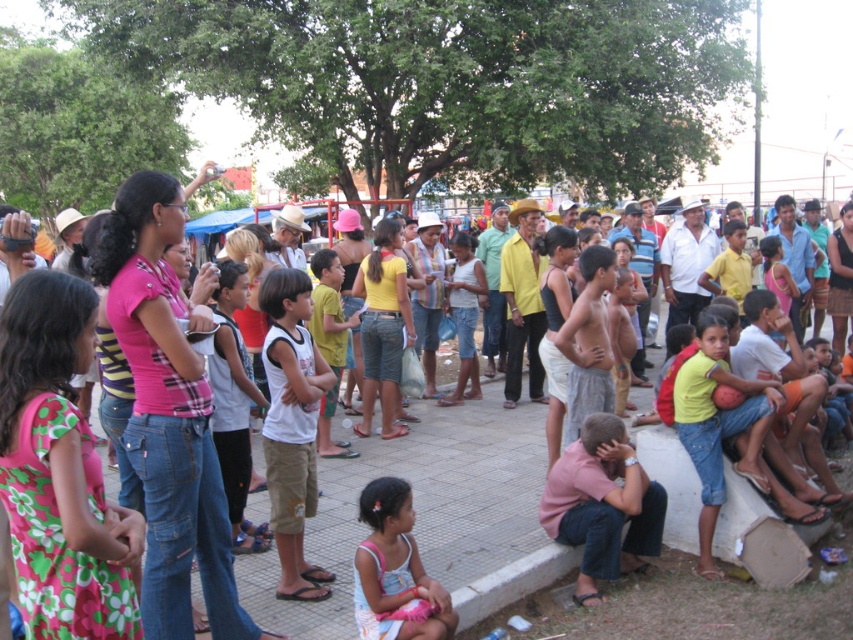
Question: Can you confirm if white cotton tank top at center is positioned below yellow matte shirt at lower right?

Choices:
 (A) yes
 (B) no

Answer: (B)

Question: Which point is farther to the camera?

Choices:
 (A) yellow matte shirt at lower right
 (B) jeans at center
 (C) white cotton dress at center

Answer: (A)

Question: Which is nearer to the white cotton dress at center?

Choices:
 (A) yellow matte shirt at lower right
 (B) jeans at center
 (C) white cotton tank top at center

Answer: (B)

Question: Can you confirm if jeans at center is bigger than yellow matte shirt at lower right?

Choices:
 (A) yes
 (B) no

Answer: (A)

Question: Does jeans at center have a smaller size compared to white cotton dress at center?

Choices:
 (A) no
 (B) yes

Answer: (A)

Question: Which of the following is the closest to the observer?

Choices:
 (A) jeans at center
 (B) yellow matte shirt at lower right
 (C) white cotton dress at center
 (D) white cotton tank top at center

Answer: (C)